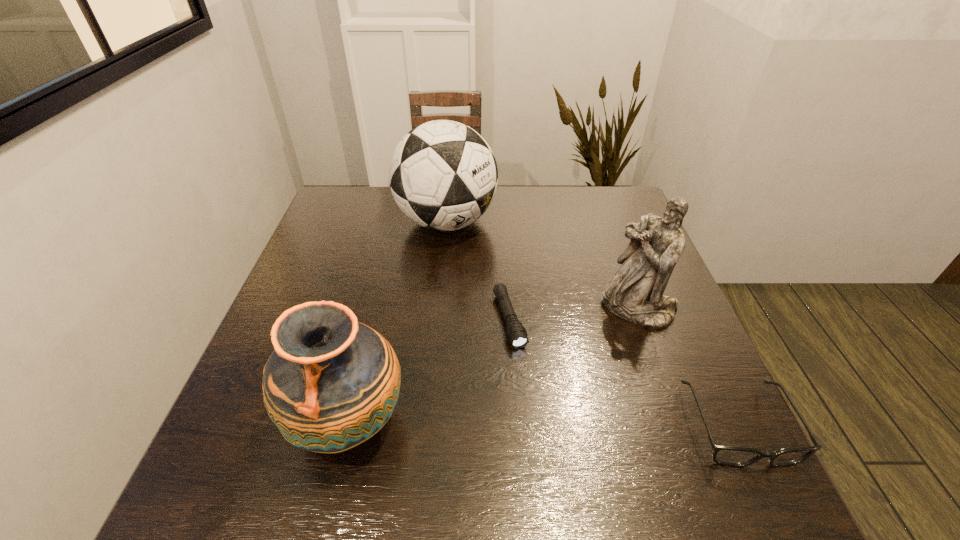
This screenshot has height=540, width=960. I want to click on figurine present at the right edge, so click(635, 293).

You are a GUI agent. You are given a task and a screenshot of the screen. Output one action in this format:
    pyautogui.click(x=<x>, y=<y>)
    Task: Click on the object located at the near left corner
    The image size is (960, 540).
    Given the screenshot: What is the action you would take?
    pyautogui.click(x=332, y=383)

The height and width of the screenshot is (540, 960). Find the location of `object that is at the near right corner`. object that is at the near right corner is located at coordinates (734, 456).

The width and height of the screenshot is (960, 540). I want to click on vacant space at the far edge of the desktop, so click(490, 218).

I want to click on vacant region at the near edge of the desktop, so click(627, 434).

Where is `vacant space at the left edge of the desktop`? The image size is (960, 540). vacant space at the left edge of the desktop is located at coordinates (321, 243).

Find the location of a particular element. free space at the right edge of the desktop is located at coordinates (688, 379).

Find the location of a particular element. This screenshot has width=960, height=540. free spot at the far left corner of the desktop is located at coordinates (322, 225).

Locate an element on the screen. This screenshot has height=540, width=960. unoccupied position between the pottery and the figurine is located at coordinates 493,364.

At what (x,y) coordinates should I click in order to perform the action: click on vacant space that is in between the flashlight and the pottery. Please return your answer as a coordinate pair (x, y). The height and width of the screenshot is (540, 960). Looking at the image, I should click on (429, 371).